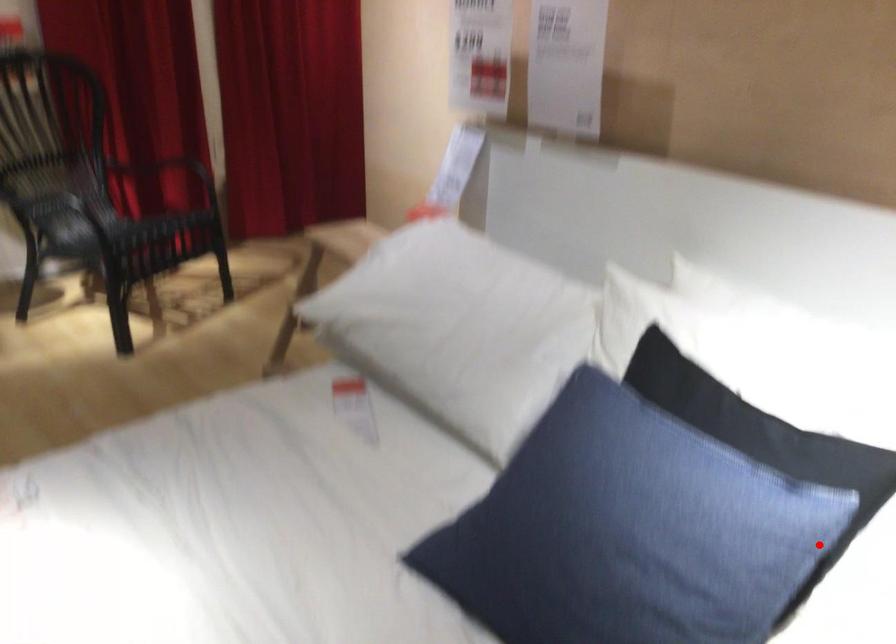
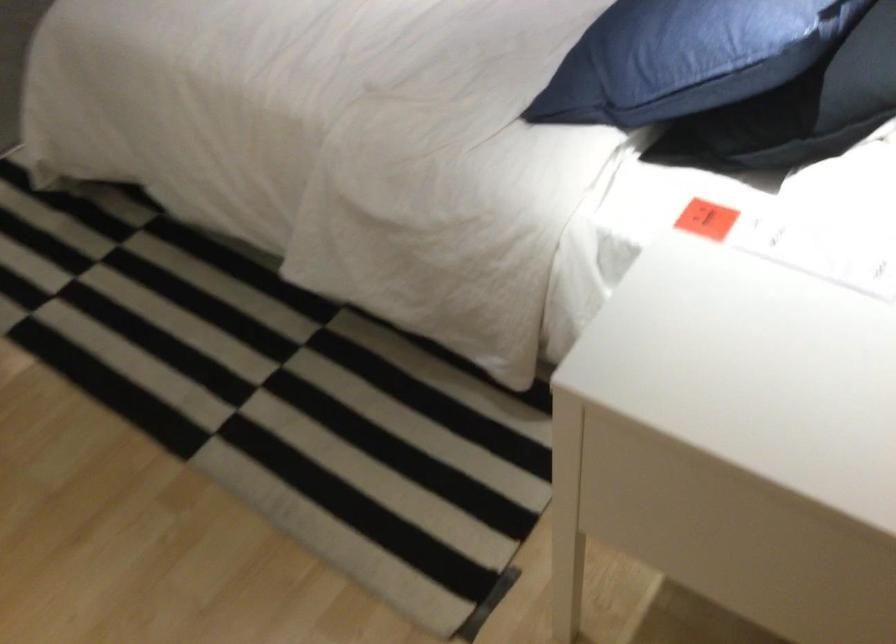
Find the pixel in the second image that matches the highlighted location in the first image.

(808, 108)